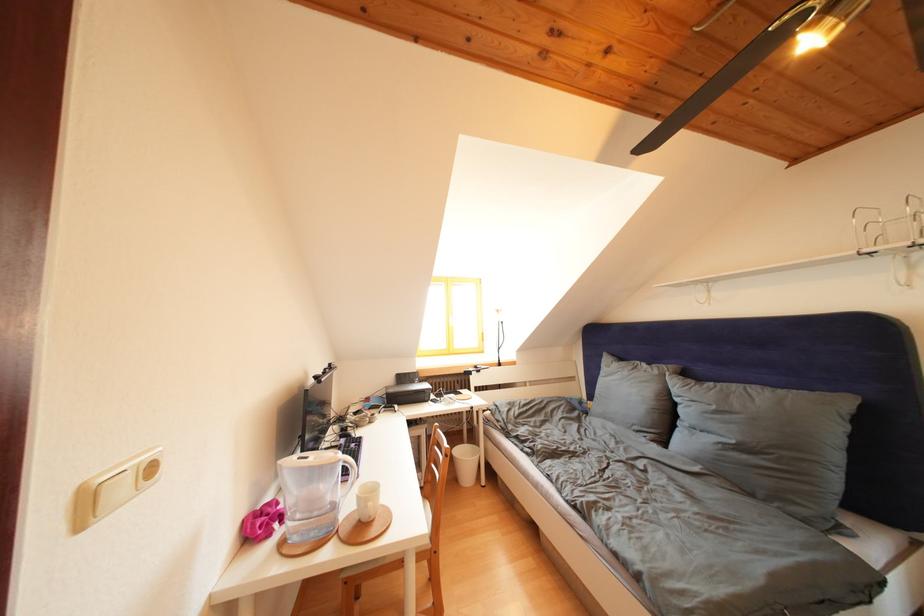
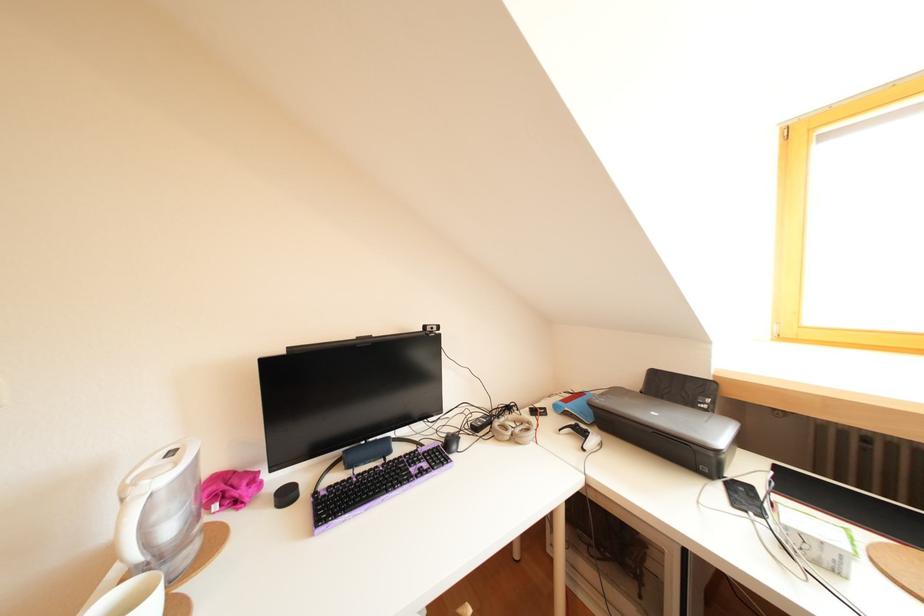
The point at (399, 395) is marked in the first image. Where is the corresponding point in the second image?

(610, 407)